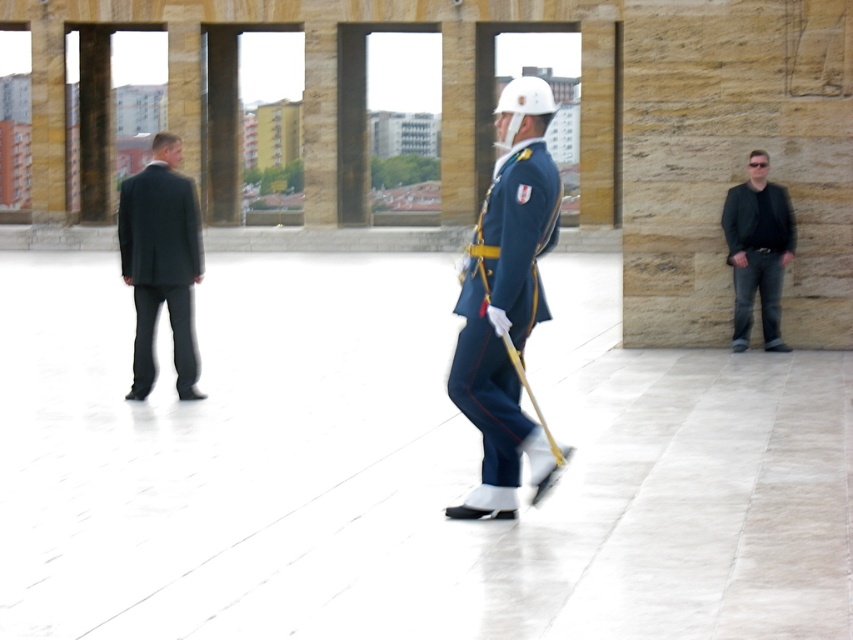
You are standing in the courtyard and notice two people wearing different outfits. The dark gray suit at left is on the left side, and the black leather jacket at right is on the right side. Which outfit is closer to the entrance of the courtyard?

The dark gray suit at left is closer to the entrance of the courtyard because it is positioned to the left of the black leather jacket at right, and in many architectural layouts, entrances are often located on the left side.

You are a photographer standing in the courtyard. You want to take a photo of the blue uniform at center and the black leather jacket at right. Which object should you focus on first if you want to capture both in the same frame without moving the camera?

The blue uniform at center is shorter than the black leather jacket at right, so you should focus on the blue uniform at center first to ensure both are in focus since it is closer to the camera.